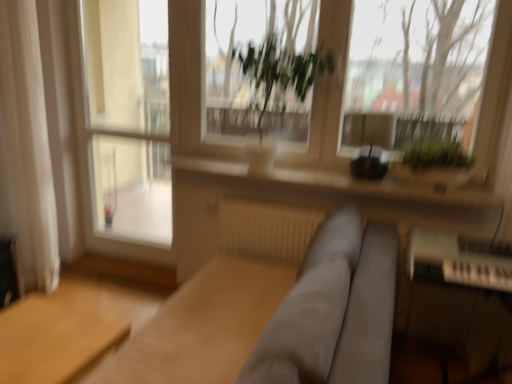
Question: Considering the positions of green leafy plant at center, the second vegetation viewed from the right, and white glass screen door at left in the image, is green leafy plant at center, the second vegetation viewed from the right, taller or shorter than white glass screen door at left?

Choices:
 (A) short
 (B) tall

Answer: (A)

Question: Relative to white glass screen door at left, is green leafy plant at center, the second vegetation viewed from the right, in front or behind?

Choices:
 (A) front
 (B) behind

Answer: (A)

Question: Which object is the closest to the white plastic piano at lower right?

Choices:
 (A) green leafy plant at upper right, the 2th vegetation viewed from the left
 (B) white glass screen door at left
 (C) light brown wooden table at lower left
 (D) gray fabric couch at center
 (E) green matte plant at upper center

Answer: (A)

Question: Considering the real-world distances, which object is farthest from the light brown wooden table at lower left?

Choices:
 (A) green leafy plant at upper right, the 2th vegetation viewed from the left
 (B) white plastic piano at lower right
 (C) white fabric curtain at left
 (D) white glass screen door at left
 (E) green matte plant at upper center

Answer: (A)